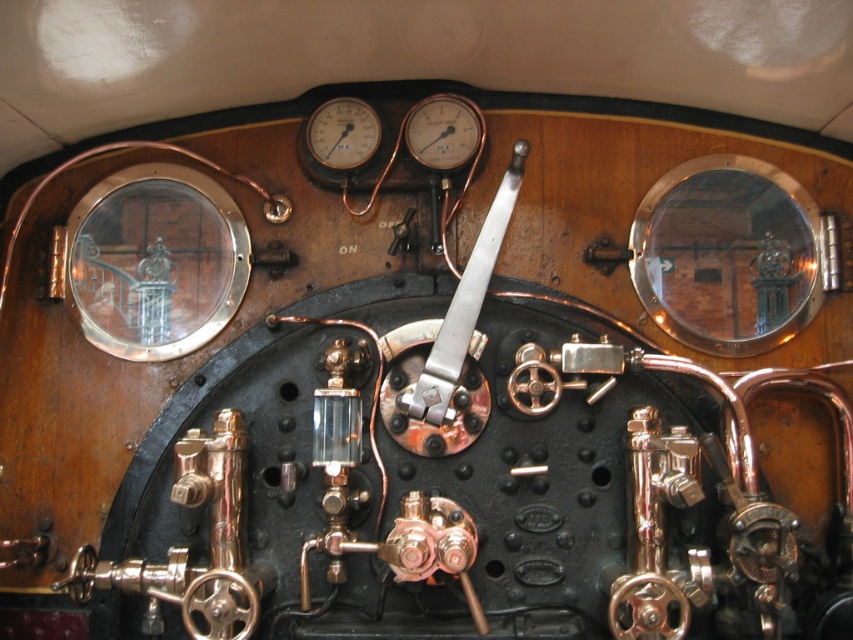
Question: Is matte black gauge at upper center wider than matte brass gauge at upper center?

Choices:
 (A) no
 (B) yes

Answer: (B)

Question: Is matte black gauge at upper center behind matte brass gauge at upper center?

Choices:
 (A) no
 (B) yes

Answer: (A)

Question: Is matte black gauge at upper center further to the viewer compared to matte brass gauge at upper center?

Choices:
 (A) no
 (B) yes

Answer: (A)

Question: Among these objects, which one is nearest to the camera?

Choices:
 (A) matte black gauge at upper center
 (B) matte brass gauge at upper center

Answer: (A)

Question: Among these points, which one is farthest from the camera?

Choices:
 (A) (361, 124)
 (B) (416, 148)

Answer: (A)